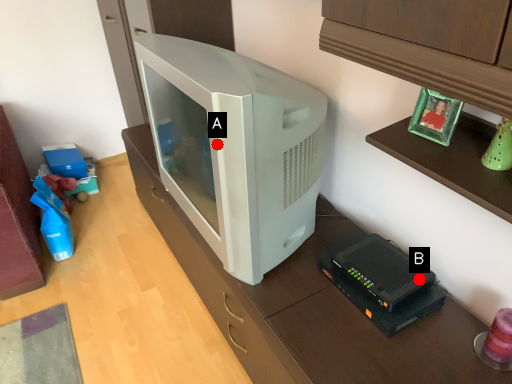
Question: Two points are circled on the image, labeled by A and B beside each circle. Among these points, which one is farthest from the camera?

Choices:
 (A) A is further
 (B) B is further

Answer: (B)